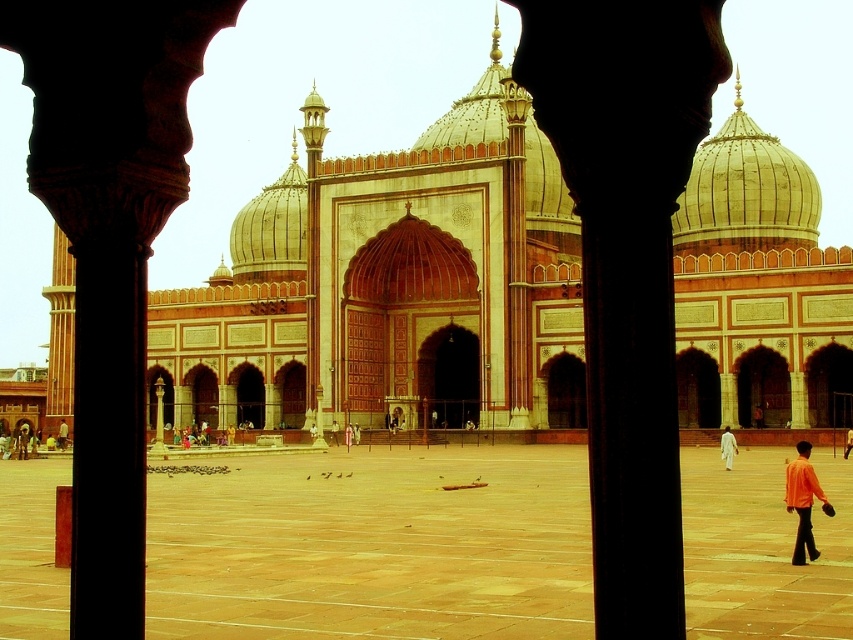
Question: Can you confirm if smooth stone palace at center is positioned below white cotton person at center?

Choices:
 (A) no
 (B) yes

Answer: (A)

Question: Is smooth stone palace at center positioned in front of orange cotton shirt at lower right?

Choices:
 (A) yes
 (B) no

Answer: (B)

Question: Can you confirm if smooth stone palace at center is smaller than white cotton person at center?

Choices:
 (A) no
 (B) yes

Answer: (A)

Question: Which object appears closest to the camera in this image?

Choices:
 (A) white cotton person at center
 (B) smooth stone courtyard at center
 (C) orange cotton shirt at lower right

Answer: (B)

Question: Among these objects, which one is farthest from the camera?

Choices:
 (A) smooth stone palace at center
 (B) white cotton person at center

Answer: (A)

Question: Which object is positioned farthest from the smooth stone palace at center?

Choices:
 (A) white cotton person at center
 (B) black stone pillar at center

Answer: (B)